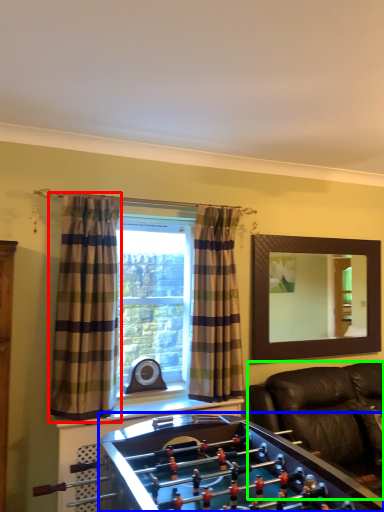
Question: Which object is positioned closest to curtain (highlighted by a red box)? Select from furniture (highlighted by a blue box) and studio couch (highlighted by a green box).

Choices:
 (A) furniture
 (B) studio couch

Answer: (A)